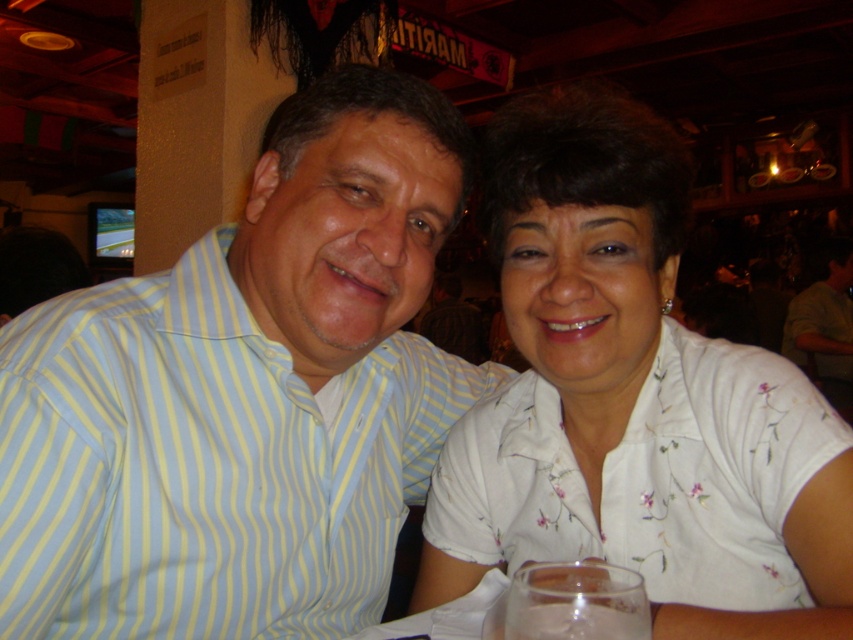
You are a photographer taking a picture of the two people wearing the light blue striped shirt at center and the white floral shirt at center. Which shirt will appear larger in the photo?

The light blue striped shirt at center will appear larger in the photo because it is closer to the viewer than the white floral shirt at center.

You are a photographer taking a picture of two people sitting at a table. You need to ensure the light blue striped shirt at center and the white floral shirt at center are both in the frame. Which shirt should you focus on first to capture both in the shot?

The light blue striped shirt at center is to the left of white floral shirt at center, so you should focus on the light blue striped shirt at center first to ensure both are in the frame.

You are a photographer trying to capture a closeup of both the light blue striped shirt at center and the white floral shirt at center. Since you want both shirts to appear equally prominent in the photo, which shirt should you zoom in on more?

The light blue striped shirt at center is larger than the white floral shirt at center, so you should zoom in more on the white floral shirt at center to make both shirts appear equally prominent.